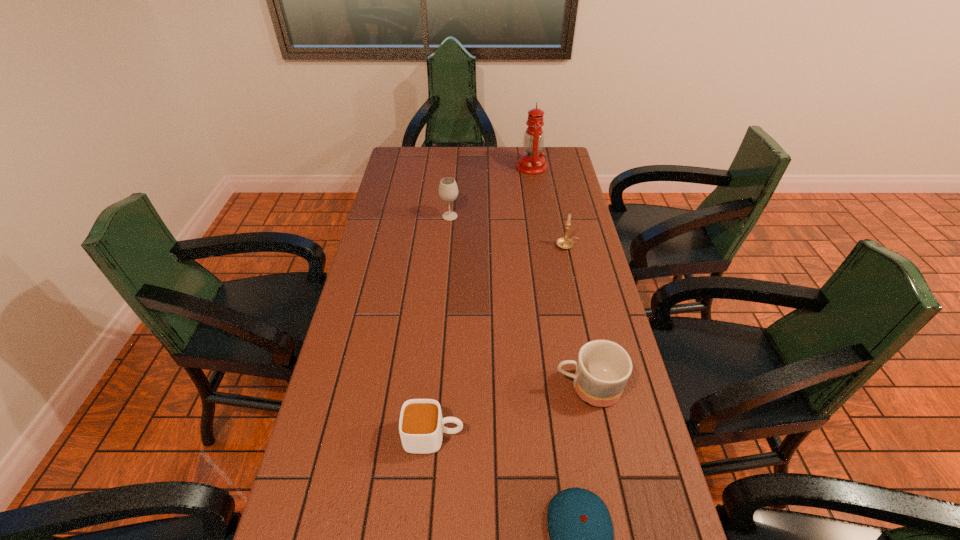
The height and width of the screenshot is (540, 960). I want to click on the tallest object, so click(x=531, y=162).

Where is `oil lamp`? Image resolution: width=960 pixels, height=540 pixels. oil lamp is located at coordinates (531, 162).

Identify the location of the fifth nearest object. This screenshot has height=540, width=960. (448, 191).

Image resolution: width=960 pixels, height=540 pixels. I want to click on the third farthest object, so click(x=564, y=242).

Where is `the fourth tallest object`? the fourth tallest object is located at coordinates (603, 367).

This screenshot has width=960, height=540. In order to click on mug in this screenshot , I will do `click(603, 367)`.

The height and width of the screenshot is (540, 960). I want to click on the second nearest object, so click(421, 427).

Image resolution: width=960 pixels, height=540 pixels. Identify the location of the fifth tallest object. (421, 427).

The image size is (960, 540). I want to click on vacant space situated 0.370m on the front of the tallest object, so click(541, 229).

Identify the location of free location located 0.310m on the back of the fifth nearest object. (454, 169).